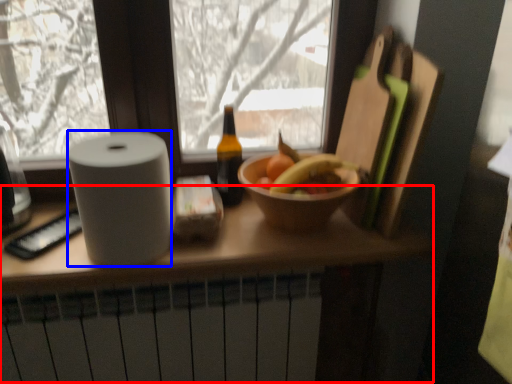
Question: Which object appears closest to the camera in this image, counter (highlighted by a red box) or paper towel (highlighted by a blue box)?

Choices:
 (A) counter
 (B) paper towel

Answer: (B)